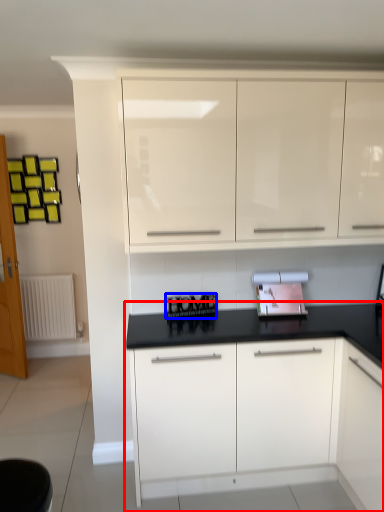
Question: Among these objects, which one is nearest to the camera, cabinetry (highlighted by a red box) or writing (highlighted by a blue box)?

Choices:
 (A) cabinetry
 (B) writing

Answer: (A)